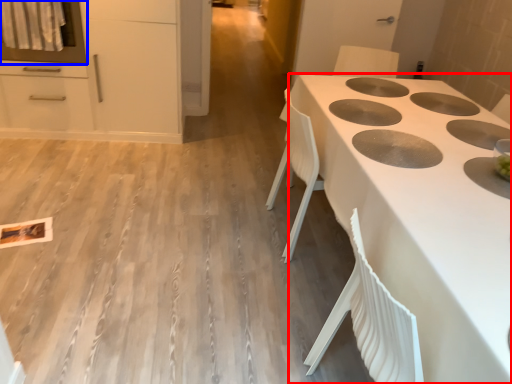
Question: Among these objects, which one is farthest to the camera, countertop (highlighted by a red box) or oven (highlighted by a blue box)?

Choices:
 (A) countertop
 (B) oven

Answer: (B)